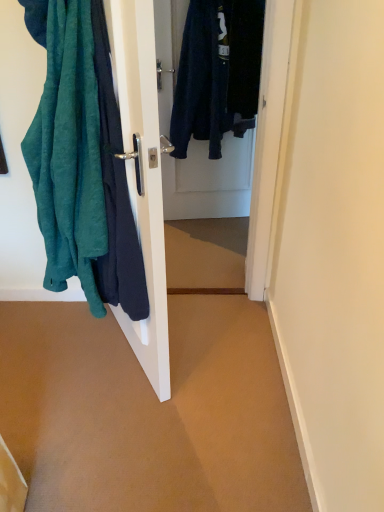
Question: Is teal fabric at left to the right of dark blue fabric door at center from the viewer's perspective?

Choices:
 (A) no
 (B) yes

Answer: (A)

Question: Is teal fabric at left positioned before dark blue fabric door at center?

Choices:
 (A) no
 (B) yes

Answer: (B)

Question: Is dark blue fabric door at center inside teal fabric at left?

Choices:
 (A) no
 (B) yes

Answer: (A)

Question: Is teal fabric at left facing away from dark blue fabric door at center?

Choices:
 (A) yes
 (B) no

Answer: (B)

Question: Considering the relative sizes of teal fabric at left and dark blue fabric door at center in the image provided, is teal fabric at left bigger than dark blue fabric door at center?

Choices:
 (A) no
 (B) yes

Answer: (B)

Question: Is teal fabric at left taller than dark blue fabric door at center?

Choices:
 (A) no
 (B) yes

Answer: (B)

Question: Does dark blue fabric door at center have a lesser height compared to teal fabric at left?

Choices:
 (A) yes
 (B) no

Answer: (A)

Question: Could teal fabric at left be considered to be inside dark blue fabric door at center?

Choices:
 (A) no
 (B) yes

Answer: (A)

Question: Is dark blue fabric door at center facing away from teal fabric at left?

Choices:
 (A) no
 (B) yes

Answer: (A)

Question: Is dark blue fabric door at center thinner than teal fabric at left?

Choices:
 (A) yes
 (B) no

Answer: (A)

Question: Can you confirm if dark blue fabric door at center is wider than teal fabric at left?

Choices:
 (A) no
 (B) yes

Answer: (A)

Question: From a real-world perspective, is dark blue fabric door at center under teal fabric at left?

Choices:
 (A) no
 (B) yes

Answer: (B)

Question: From the image's perspective, is teal fabric at left positioned above or below dark blue fabric door at center?

Choices:
 (A) below
 (B) above

Answer: (A)